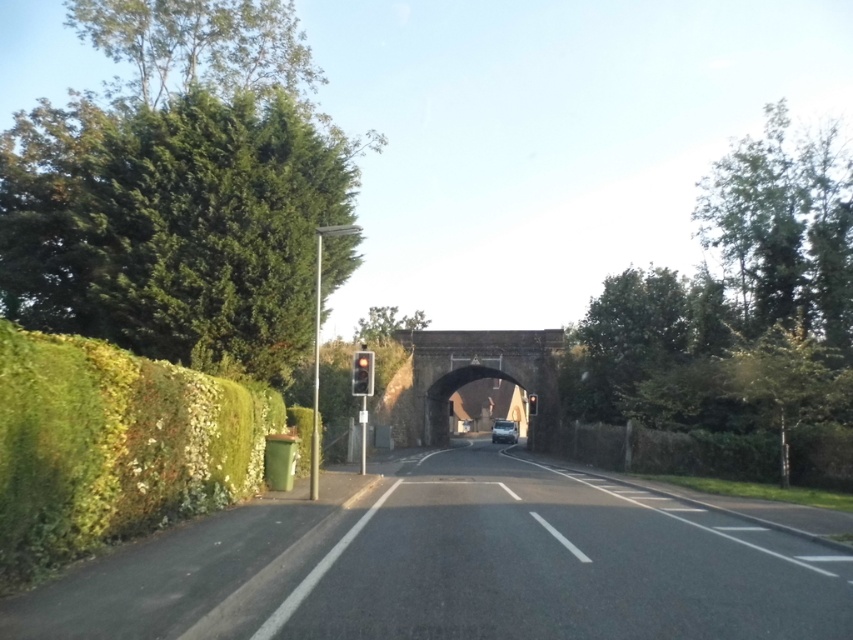
You are driving a car and see two points on the road ahead. The first point is at coordinate point (845, 380) and the second is at point (361, 324). Which point is closer to your current position?

Point (361, 324) is closer to your current position because it is behind point (845, 380), which is in front of it.

You are driving a car and need to park near the green leafy hedge at left and the metallic silver van at center. Based on their sizes, which one would be easier to spot from a distance?

The metallic silver van at center is larger than the green leafy hedge at left, so it would be easier to spot from a distance.

You are driving a car and see the green leafy hedge at left and the metallic silver van at center. Which object is closer to the left side of the road?

The green leafy hedge at left is closer to the left side of the road because it is positioned to the left of the metallic silver van at center.